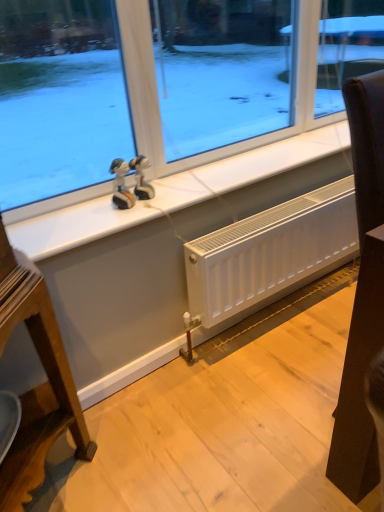
The width and height of the screenshot is (384, 512). What are the coordinates of `free point to the left of glossy plastic figurine at upper center, marked as the second figurine in a left-to-right arrangement` in the screenshot? It's located at (89, 210).